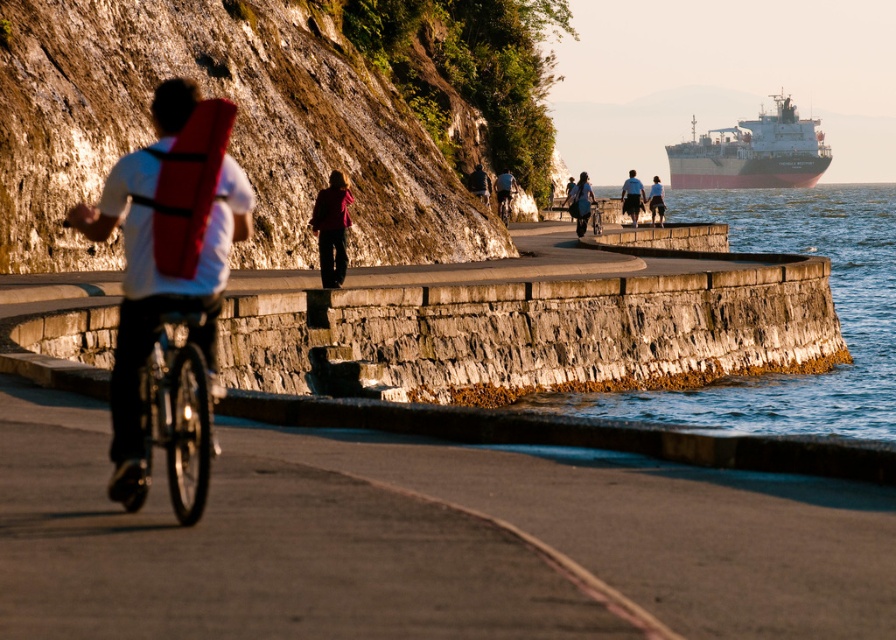
You are a photographer trying to capture the white matte cargo ship at upper right and the matte black shorts at center in the same frame. Given that your camera has a fixed focal length, which object should you position closer to the center of the frame to ensure both are visible without zooming?

Since the white matte cargo ship at upper right is wider than the matte black shorts at center, you should position the wider white matte cargo ship at upper right closer to the center of the frame to ensure both objects are visible without zooming.

Consider the image. You are a photographer trying to capture the cyclist and their bicycle in the scene. You want to ensure the matte black jacket at center and the metallic silver bicycle at center are both in the frame. Based on their positions, which object should you focus on first to ensure both are captured properly?

The matte black jacket at center is positioned on the left side of the metallic silver bicycle at center, so focusing on the metallic silver bicycle at center first will naturally include the matte black jacket at center in the frame as it is to the left.

You are a photographer wanting to capture the matte red jacket at center and the metallic silver bicycle at center in a single shot. Since you want the jacket to be on the left side of the bicycle in the photo, does the current arrangement allow this?

Yes, the matte red jacket at center is already positioned on the left side of the metallic silver bicycle at center, so the current arrangement allows the jacket to be on the left side of the bicycle in the photo.